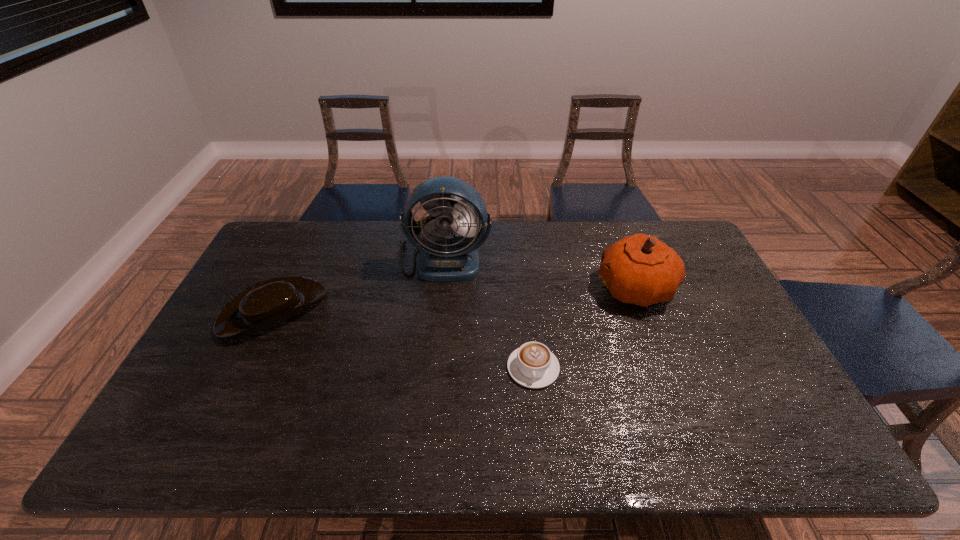
This screenshot has width=960, height=540. Identify the location of vacant space in between the fan and the pumpkin. (540, 274).

Where is `vacant space in between the rightmost object and the second shortest object`? vacant space in between the rightmost object and the second shortest object is located at coordinates (454, 299).

This screenshot has height=540, width=960. What are the coordinates of `free space between the rightmost object and the third object from left to right` in the screenshot? It's located at (585, 328).

Locate an element on the screen. The image size is (960, 540). the closest object relative to the nearest object is located at coordinates (643, 270).

Locate an element on the screen. object that is the second closest to the second object from left to right is located at coordinates (533, 365).

The image size is (960, 540). I want to click on blank area in the image that satisfies the following two spatial constraints: 1. on the front-facing side of the second tallest object; 2. with the handle on the right side of the third object from left to right, so [665, 368].

What are the coordinates of `free space that satisfies the following two spatial constraints: 1. on the front-facing side of the rightmost object; 2. with the handle on the right side of the cappuccino` in the screenshot? It's located at (665, 368).